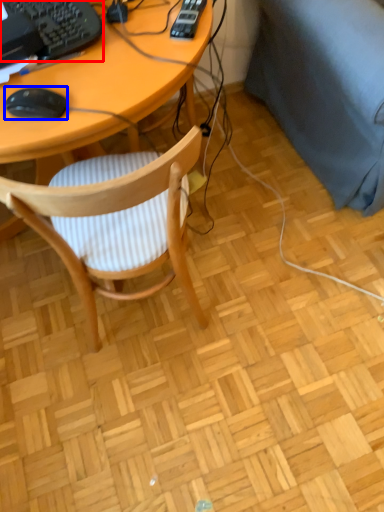
Question: Which point is further to the camera, computer keyboard (highlighted by a red box) or mouse (highlighted by a blue box)?

Choices:
 (A) computer keyboard
 (B) mouse

Answer: (A)